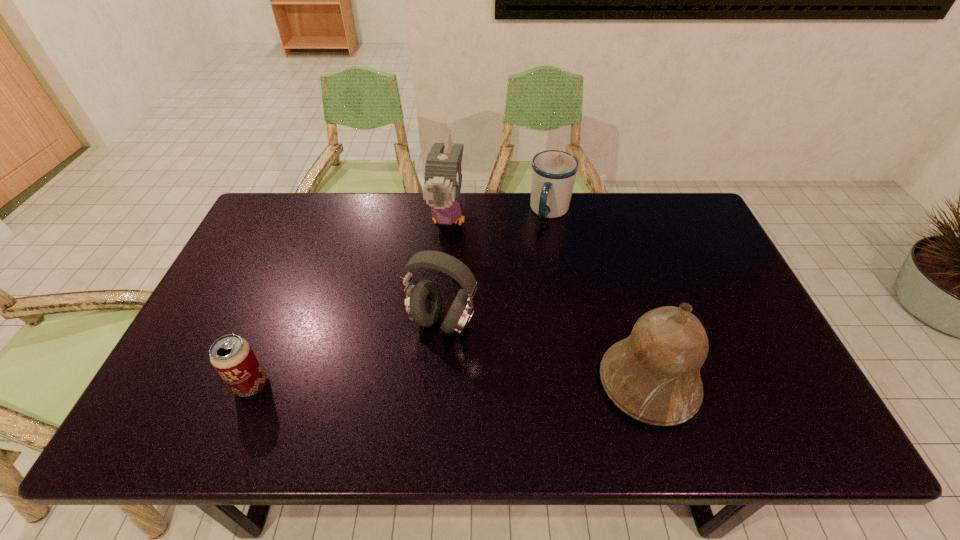
The height and width of the screenshot is (540, 960). What are the coordinates of `bell at the near edge` in the screenshot? It's located at (653, 375).

Where is `object positioned at the left edge`? object positioned at the left edge is located at coordinates (233, 358).

Where is `object at the near left corner`? object at the near left corner is located at coordinates (233, 358).

The height and width of the screenshot is (540, 960). In the image, there is a desktop. What are the coordinates of `vacant space at the far edge` in the screenshot? It's located at (395, 207).

At what (x,y) coordinates should I click in order to perform the action: click on vacant space at the near edge of the desktop. Please return your answer as a coordinate pair (x, y). The width and height of the screenshot is (960, 540). Looking at the image, I should click on (486, 380).

In the image, there is a desktop. Where is `vacant space at the left edge`? vacant space at the left edge is located at coordinates (224, 335).

At what (x,y) coordinates should I click in order to perform the action: click on free region at the right edge of the desktop. Please return your answer as a coordinate pair (x, y). Looking at the image, I should click on (706, 276).

Locate an element on the screen. Image resolution: width=960 pixels, height=540 pixels. vacant space at the far right corner of the desktop is located at coordinates (669, 202).

You are a GUI agent. You are given a task and a screenshot of the screen. Output one action in this format:
    pyautogui.click(x=<x>, y=<y>)
    Task: Click on the unoccupied area between the bell and the bird
    The image size is (960, 540).
    Given the screenshot: What is the action you would take?
    pyautogui.click(x=548, y=301)

Find the location of a particular element. blank region between the bell and the mug is located at coordinates (599, 298).